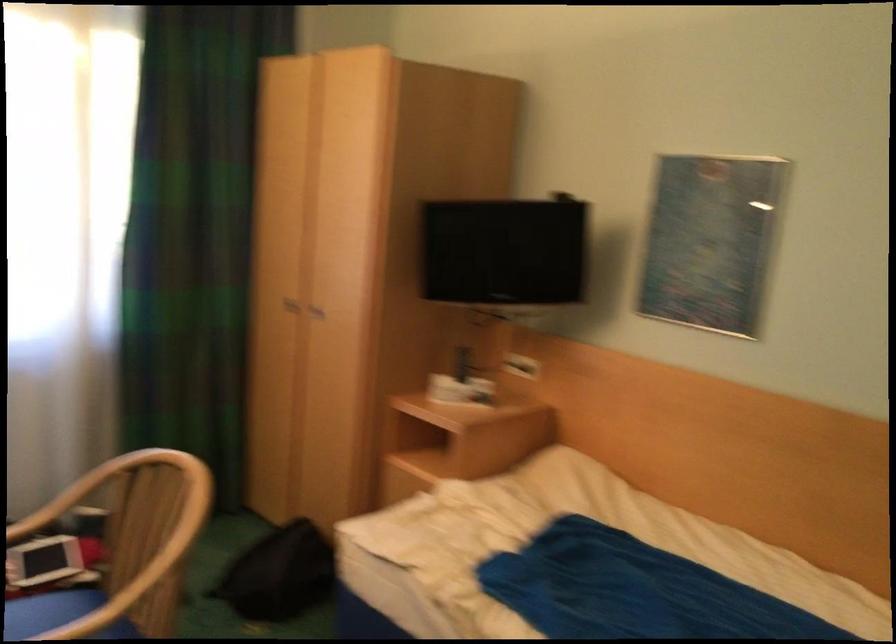
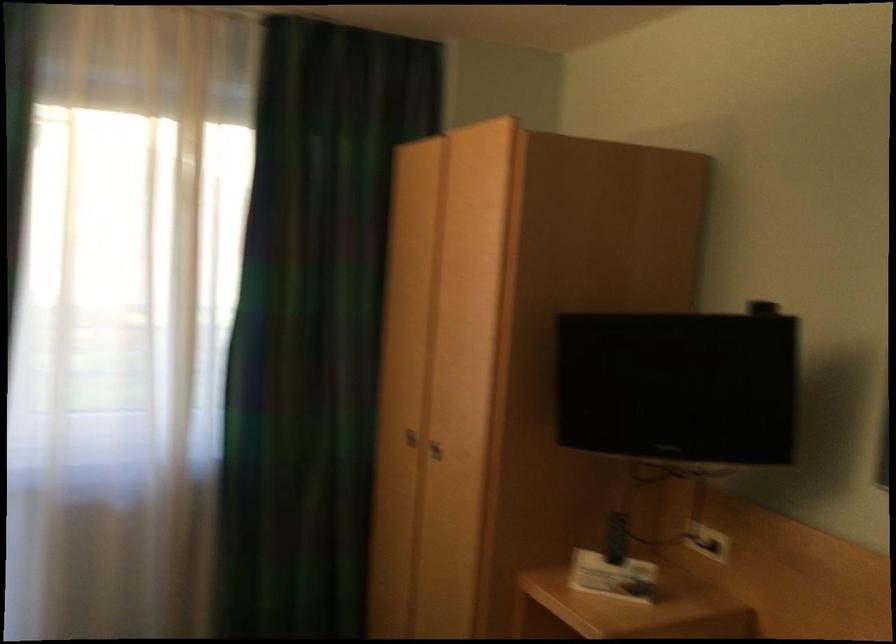
In the second image, find the point that corresponds to the point at 462,362 in the first image.

(616, 538)